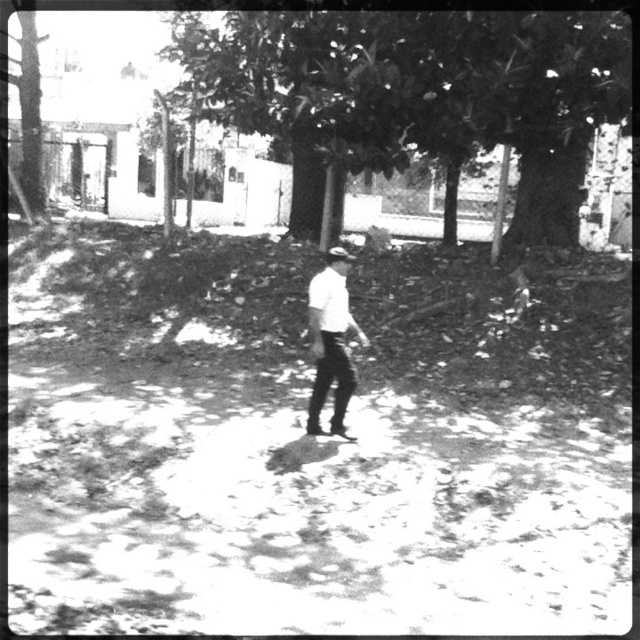
Who is more distant from viewer, (435, 104) or (332, 336)?

The point (435, 104) is more distant.

The image size is (640, 640). I want to click on smooth bark tree at center, so click(x=412, y=92).